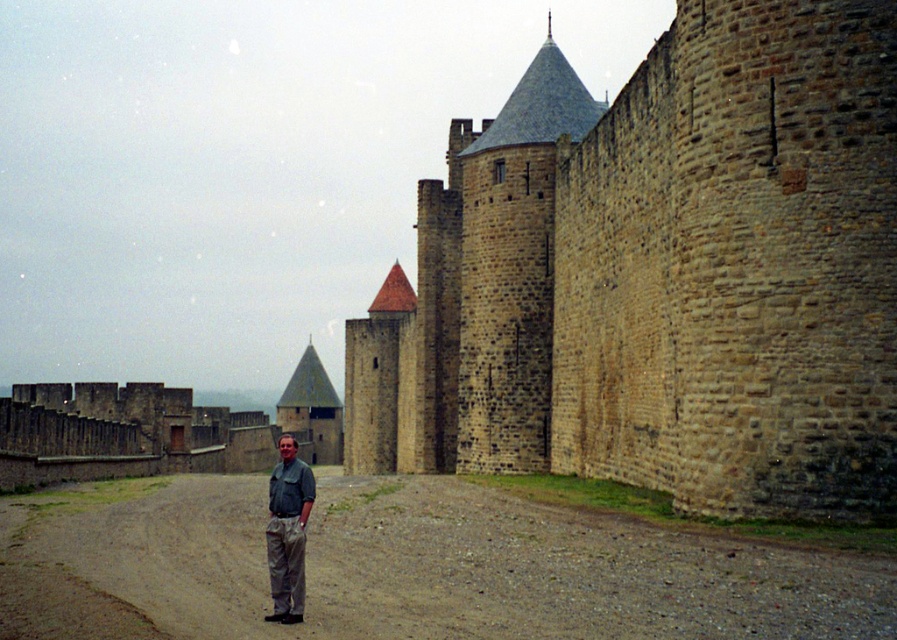
Question: Is brown stone wall at center positioned before khaki pants at center?

Choices:
 (A) no
 (B) yes

Answer: (A)

Question: Which point is farther to the camera?

Choices:
 (A) (565, 266)
 (B) (208, 579)
 (C) (303, 508)

Answer: (A)

Question: Is brown gravel road at center closer to the viewer compared to khaki pants at center?

Choices:
 (A) yes
 (B) no

Answer: (A)

Question: Which point appears farthest from the camera in this image?

Choices:
 (A) (893, 28)
 (B) (283, 602)

Answer: (A)

Question: Can you confirm if brown gravel road at center is wider than khaki pants at center?

Choices:
 (A) no
 (B) yes

Answer: (B)

Question: Among these objects, which one is farthest from the camera?

Choices:
 (A) brown gravel road at center
 (B) brown stone wall at center

Answer: (B)